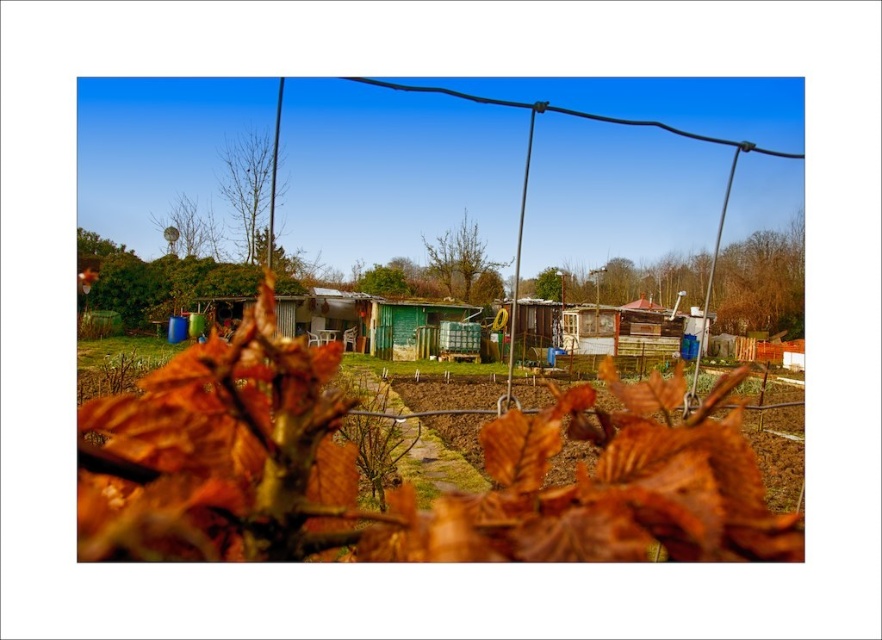
Question: Which of these objects is positioned farthest from the brown textured tree at center?

Choices:
 (A) bare branches at upper center
 (B) green matte satellite dish at upper center

Answer: (B)

Question: Does brown wooden fence at center appear under green matte satellite dish at upper center?

Choices:
 (A) yes
 (B) no

Answer: (A)

Question: Which point is farther to the camera?

Choices:
 (A) (469, 227)
 (B) (667, 260)
 (C) (234, 186)
 (D) (178, 204)

Answer: (B)

Question: Which point appears closest to the camera in this image?

Choices:
 (A) (281, 192)
 (B) (456, 288)
 (C) (761, 228)
 (D) (196, 227)

Answer: (D)

Question: Is brown textured tree at center to the left of green matte satellite dish at upper center from the viewer's perspective?

Choices:
 (A) no
 (B) yes

Answer: (A)

Question: From the image, what is the correct spatial relationship of bare branches at upper center in relation to green matte satellite dish at upper center?

Choices:
 (A) right
 (B) left

Answer: (A)